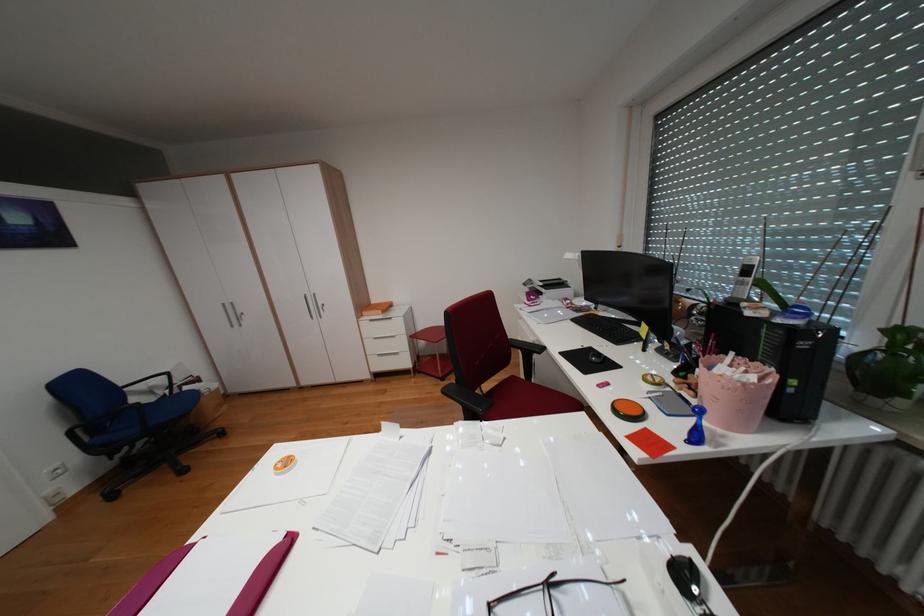
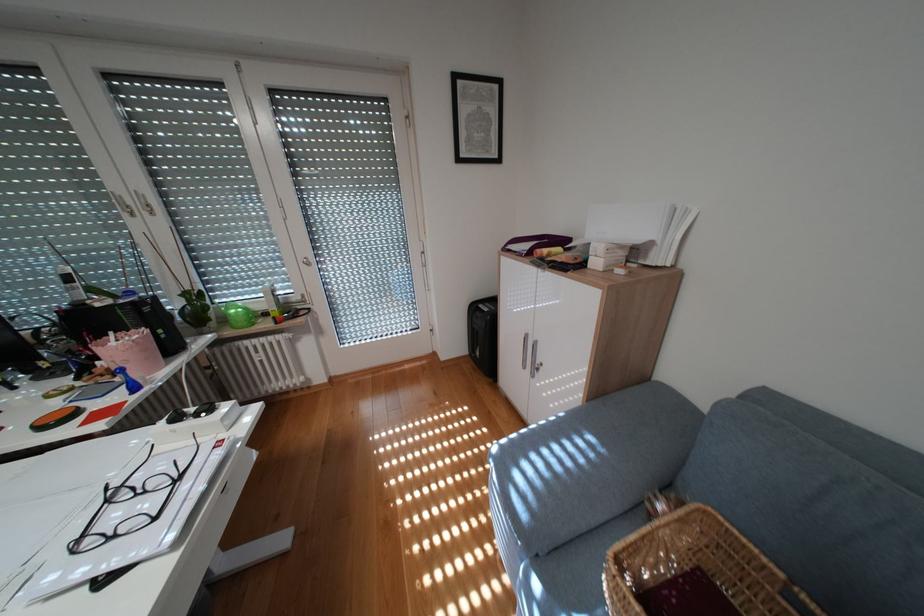
Where in the second image is the point corresponding to point 696,573 from the first image?

(188, 418)